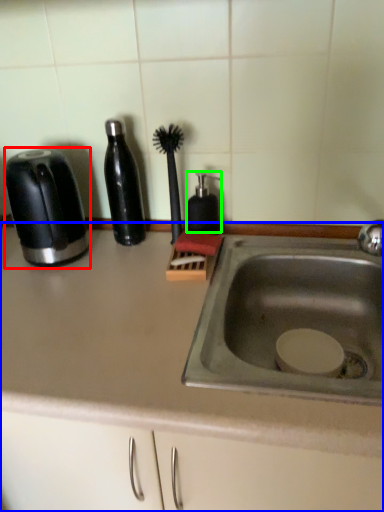
Question: Which object is the closest to the toaster (highlighted by a red box)? Choose among these: countertop (highlighted by a blue box) or soap dispenser (highlighted by a green box).

Choices:
 (A) countertop
 (B) soap dispenser

Answer: (A)